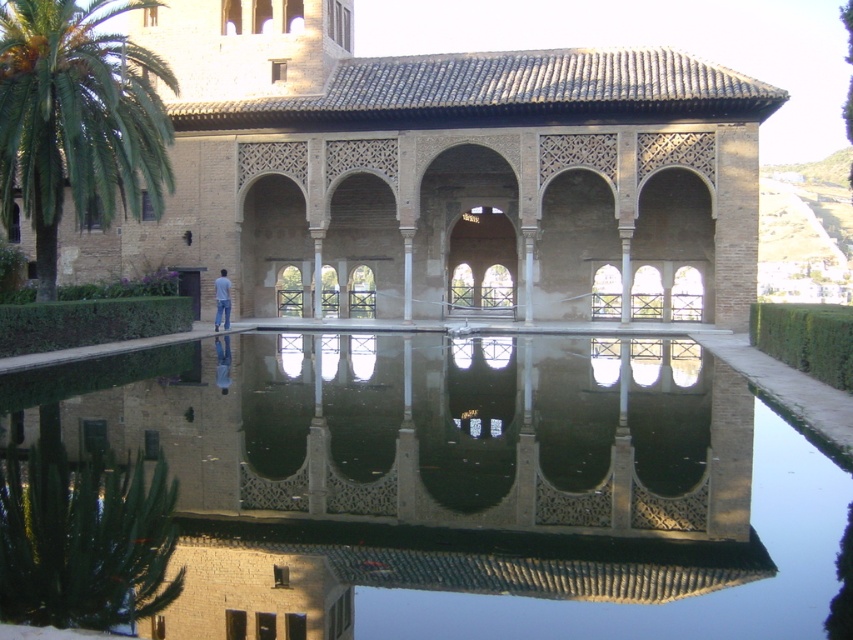
Between clear glass water at center and blue jeans at center, which one appears on the left side from the viewer's perspective?

Positioned to the left is blue jeans at center.

Is clear glass water at center below blue jeans at center?

Yes.

Is point (340, 429) closer to camera compared to point (228, 310)?

That is True.

Locate an element on the screen. clear glass water at center is located at coordinates (462, 484).

The height and width of the screenshot is (640, 853). In order to click on brown textured stone palace at center in this screenshot , I will do `click(440, 173)`.

Is brown textured stone palace at center to the left of blue jeans at center from the viewer's perspective?

In fact, brown textured stone palace at center is to the right of blue jeans at center.

Find the location of a particular element. The image size is (853, 640). brown textured stone palace at center is located at coordinates (440, 173).

In the scene shown: Does clear glass water at center have a greater height compared to green leafy palm tree at left?

No.

What do you see at coordinates (462, 484) in the screenshot? I see `clear glass water at center` at bounding box center [462, 484].

Image resolution: width=853 pixels, height=640 pixels. Find the location of `clear glass water at center`. clear glass water at center is located at coordinates (462, 484).

Find the location of a particular element. clear glass water at center is located at coordinates (462, 484).